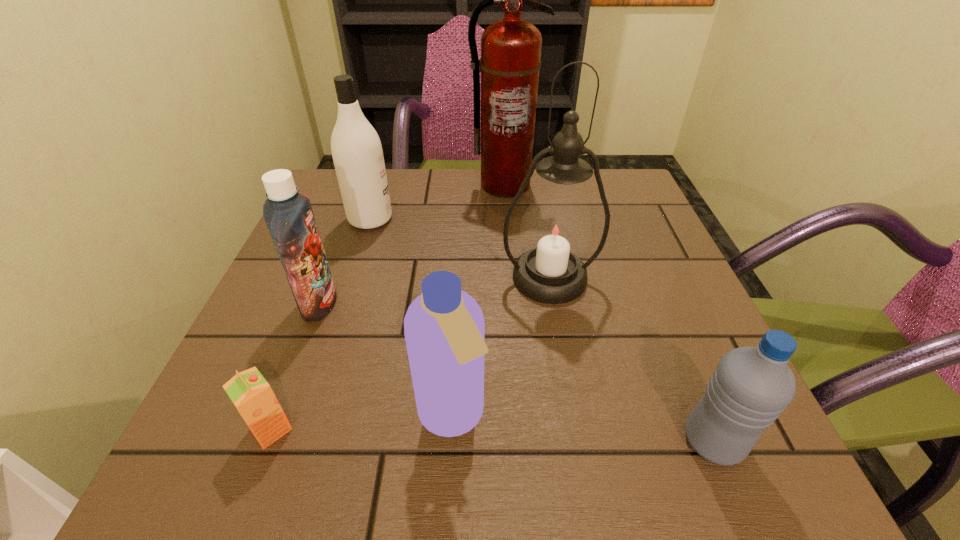
This screenshot has width=960, height=540. I want to click on vacant space located 0.110m on the left of the oil lamp, so (445, 278).

The image size is (960, 540). In order to click on vacant space situated on the front-facing side of the tallest shampoo in this screenshot , I will do `click(463, 219)`.

Identify the location of vacant space located 0.180m on the front label of the second farthest shampoo. (434, 303).

Where is `vacant position located 0.090m on the right of the rightmost shampoo`? vacant position located 0.090m on the right of the rightmost shampoo is located at coordinates (548, 416).

The width and height of the screenshot is (960, 540). In order to click on vacant space located 0.300m on the back of the sixth tallest object in this screenshot , I will do `click(645, 278)`.

Image resolution: width=960 pixels, height=540 pixels. In order to click on vacant space located on the right of the shortest object in this screenshot , I will do `click(574, 429)`.

Locate an element on the screen. Image resolution: width=960 pixels, height=540 pixels. fire extinguisher located at the far edge is located at coordinates (510, 62).

Image resolution: width=960 pixels, height=540 pixels. Identify the location of shampoo that is at the far edge. (357, 152).

Where is `shampoo present at the near edge`? shampoo present at the near edge is located at coordinates (444, 328).

I want to click on water bottle that is positioned at the near edge, so click(x=751, y=386).